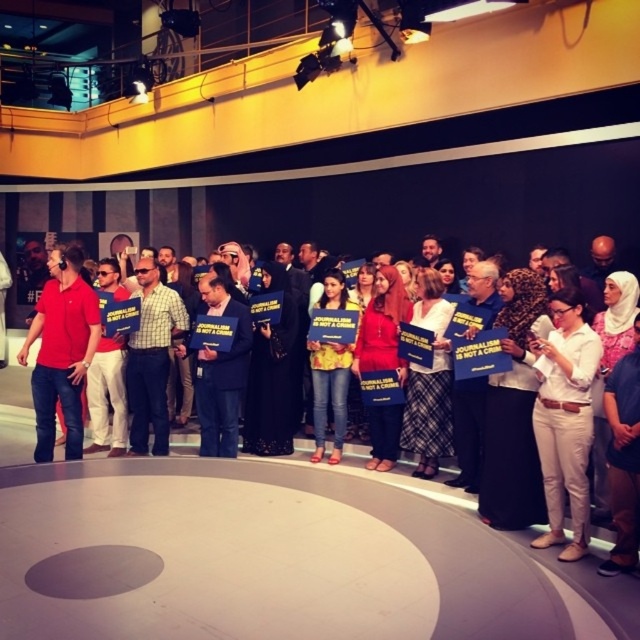
Is white cotton pants at lower right above matte red polo shirt at left?

No.

Which is below, white cotton pants at lower right or matte red polo shirt at left?

white cotton pants at lower right is lower down.

What do you see at coordinates (564, 419) in the screenshot? Image resolution: width=640 pixels, height=640 pixels. I see `white cotton pants at lower right` at bounding box center [564, 419].

You are a GUI agent. You are given a task and a screenshot of the screen. Output one action in this format:
    pyautogui.click(x=<x>, y=<y>)
    Task: Click on the white cotton pants at lower right
    The width and height of the screenshot is (640, 640).
    Given the screenshot: What is the action you would take?
    pyautogui.click(x=564, y=419)

Is point (83, 436) positioned after point (173, 445)?

No, (83, 436) is closer to viewer.

Is matte red polo shirt at left above matte blue folder at center?

Yes.

Which is in front, point (84, 372) or point (16, 436)?

Point (84, 372) is more forward.

The image size is (640, 640). I want to click on matte red polo shirt at left, so click(x=61, y=349).

Can you confirm if white cotton pants at lower right is smaller than matte blue folder at center?

No, white cotton pants at lower right is not smaller than matte blue folder at center.

Between white cotton pants at lower right and matte blue folder at center, which one has less height?

matte blue folder at center

Locate an element on the screen. The image size is (640, 640). white cotton pants at lower right is located at coordinates (564, 419).

Find the location of `white cotton pants at lower right`. white cotton pants at lower right is located at coordinates (564, 419).